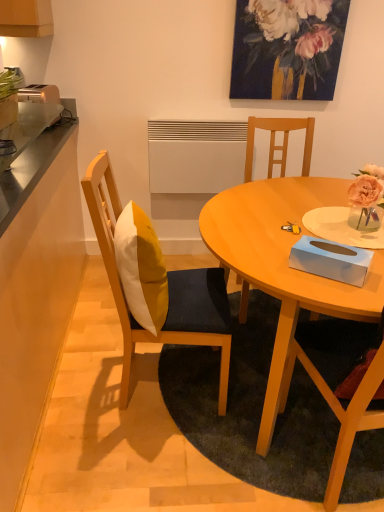
Question: Considering the relative sizes of painted floral arrangement at upper center and metallic stainless steel counter top at left, which appears as the 1th counter top when viewed from the right, in the image provided, is painted floral arrangement at upper center smaller than metallic stainless steel counter top at left, which appears as the 1th counter top when viewed from the right,?

Choices:
 (A) no
 (B) yes

Answer: (B)

Question: Is painted floral arrangement at upper center not close to metallic stainless steel counter top at left, the second counter top positioned from the left?

Choices:
 (A) no
 (B) yes

Answer: (B)

Question: Can you confirm if painted floral arrangement at upper center is shorter than metallic stainless steel counter top at left, which appears as the 1th counter top when viewed from the right?

Choices:
 (A) yes
 (B) no

Answer: (B)

Question: Can you confirm if painted floral arrangement at upper center is thinner than metallic stainless steel counter top at left, the second counter top positioned from the left?

Choices:
 (A) no
 (B) yes

Answer: (B)

Question: From a real-world perspective, is painted floral arrangement at upper center positioned under metallic stainless steel counter top at left, which appears as the 1th counter top when viewed from the right, based on gravity?

Choices:
 (A) no
 (B) yes

Answer: (A)

Question: From the image's perspective, is matte wood table at center positioned above or below yellow fabric pillow at center?

Choices:
 (A) above
 (B) below

Answer: (B)

Question: Does point (379, 263) appear closer or farther from the camera than point (135, 262)?

Choices:
 (A) farther
 (B) closer

Answer: (B)

Question: Is matte wood table at center in front of or behind yellow fabric pillow at center in the image?

Choices:
 (A) behind
 (B) front

Answer: (B)

Question: Based on their positions, is matte wood table at center located to the left or right of yellow fabric pillow at center?

Choices:
 (A) left
 (B) right

Answer: (B)

Question: Is yellow fabric pillow at center to the left or to the right of painted floral arrangement at upper center in the image?

Choices:
 (A) left
 (B) right

Answer: (A)

Question: Considering the positions of yellow fabric pillow at center and painted floral arrangement at upper center in the image, is yellow fabric pillow at center bigger or smaller than painted floral arrangement at upper center?

Choices:
 (A) small
 (B) big

Answer: (B)

Question: Choose the correct answer: Is yellow fabric pillow at center inside painted floral arrangement at upper center or outside it?

Choices:
 (A) outside
 (B) inside

Answer: (A)

Question: Is point (122, 256) positioned closer to the camera than point (278, 47)?

Choices:
 (A) farther
 (B) closer

Answer: (B)

Question: From a real-world perspective, is metallic stainless steel counter top at left, which appears as the 1th counter top when viewed from the right, above or below painted floral arrangement at upper center?

Choices:
 (A) below
 (B) above

Answer: (A)

Question: Is point (39, 150) positioned closer to the camera than point (302, 68)?

Choices:
 (A) farther
 (B) closer

Answer: (B)